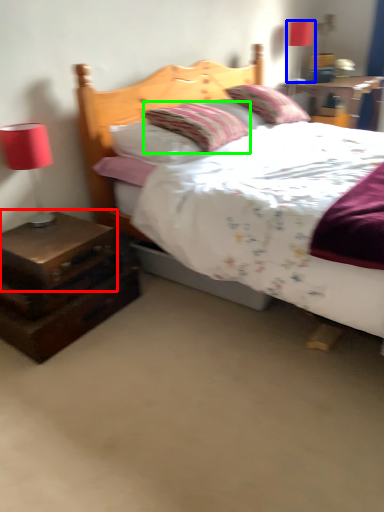
Question: Which object is positioned farthest from nightstand (highlighted by a red box)? Select from table lamp (highlighted by a blue box) and pillow (highlighted by a green box).

Choices:
 (A) table lamp
 (B) pillow

Answer: (A)